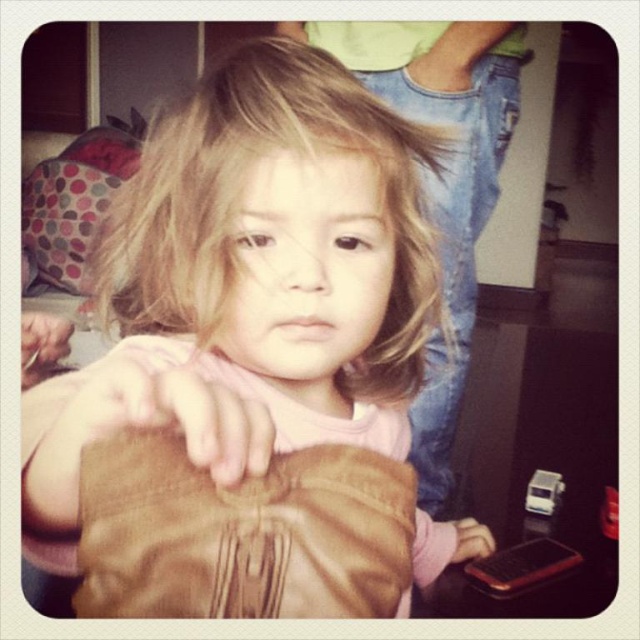
Is matte brown purse at center smaller than brown leather handbag at lower right?

No, matte brown purse at center is not smaller than brown leather handbag at lower right.

Describe the element at coordinates (252, 284) in the screenshot. I see `matte brown purse at center` at that location.

The image size is (640, 640). Identify the location of matte brown purse at center. (252, 284).

Which of these two, matte brown purse at center or leather glove at center, stands taller?

matte brown purse at center is taller.

Locate an element on the screen. matte brown purse at center is located at coordinates (252, 284).

You are a GUI agent. You are given a task and a screenshot of the screen. Output one action in this format:
    pyautogui.click(x=<x>, y=<y>)
    Task: Click on the matte brown purse at center
    This screenshot has height=640, width=640.
    Given the screenshot: What is the action you would take?
    pyautogui.click(x=252, y=284)

Can you confirm if leather bag at center is smaller than leather glove at center?

Incorrect, leather bag at center is not smaller in size than leather glove at center.

Describe the element at coordinates (243, 532) in the screenshot. The width and height of the screenshot is (640, 640). I see `leather bag at center` at that location.

Image resolution: width=640 pixels, height=640 pixels. What are the coordinates of `leather bag at center` in the screenshot? It's located at (243, 532).